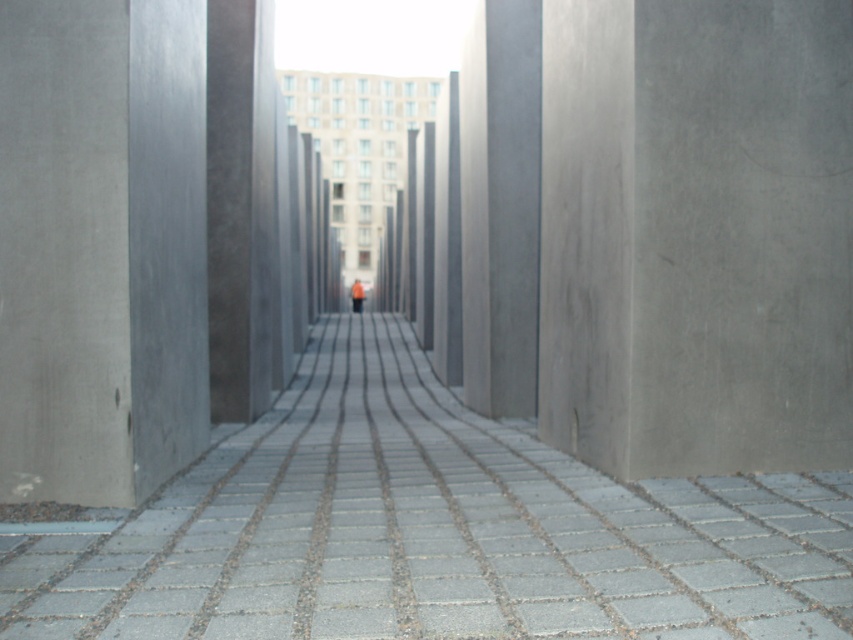
Question: Does gray concrete pavement at center come in front of orange fabric person at center?

Choices:
 (A) yes
 (B) no

Answer: (A)

Question: Which point is farther to the camera?

Choices:
 (A) gray concrete pavement at center
 (B) orange fabric person at center

Answer: (B)

Question: Is gray concrete pavement at center smaller than orange fabric person at center?

Choices:
 (A) no
 (B) yes

Answer: (B)

Question: Which of the following is the farthest from the observer?

Choices:
 (A) orange fabric person at center
 (B) gray concrete pavement at center

Answer: (A)

Question: Does gray concrete pavement at center come behind orange fabric person at center?

Choices:
 (A) no
 (B) yes

Answer: (A)